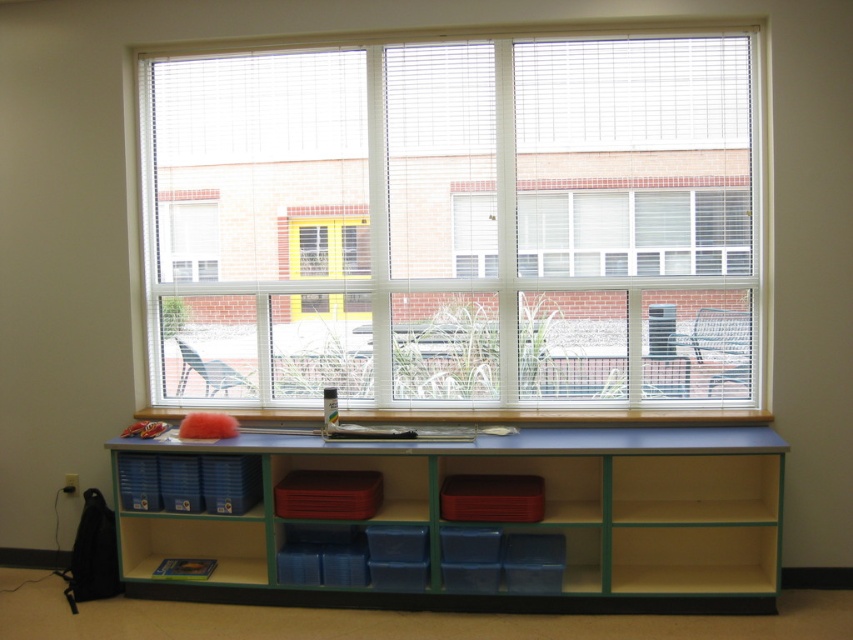
Can you confirm if white plastic blinds at upper center is smaller than wooden at lower center?

Actually, white plastic blinds at upper center might be larger than wooden at lower center.

This screenshot has width=853, height=640. Identify the location of white plastic blinds at upper center. (453, 224).

Is blue plastic bookshelf at center wider than wooden at lower center?

No.

Is blue plastic bookshelf at center above wooden at lower center?

No, blue plastic bookshelf at center is not above wooden at lower center.

Who is more distant from viewer, (695, 444) or (669, 410)?

The point (669, 410) is more distant.

Where is `blue plastic bookshelf at center`? blue plastic bookshelf at center is located at coordinates (498, 522).

Can you confirm if white plastic blinds at upper center is wider than blue plastic bookshelf at center?

No, white plastic blinds at upper center is not wider than blue plastic bookshelf at center.

Consider the image. Can you confirm if white plastic blinds at upper center is shorter than blue plastic bookshelf at center?

In fact, white plastic blinds at upper center may be taller than blue plastic bookshelf at center.

The height and width of the screenshot is (640, 853). Identify the location of white plastic blinds at upper center. (453, 224).

The width and height of the screenshot is (853, 640). I want to click on white plastic blinds at upper center, so click(453, 224).